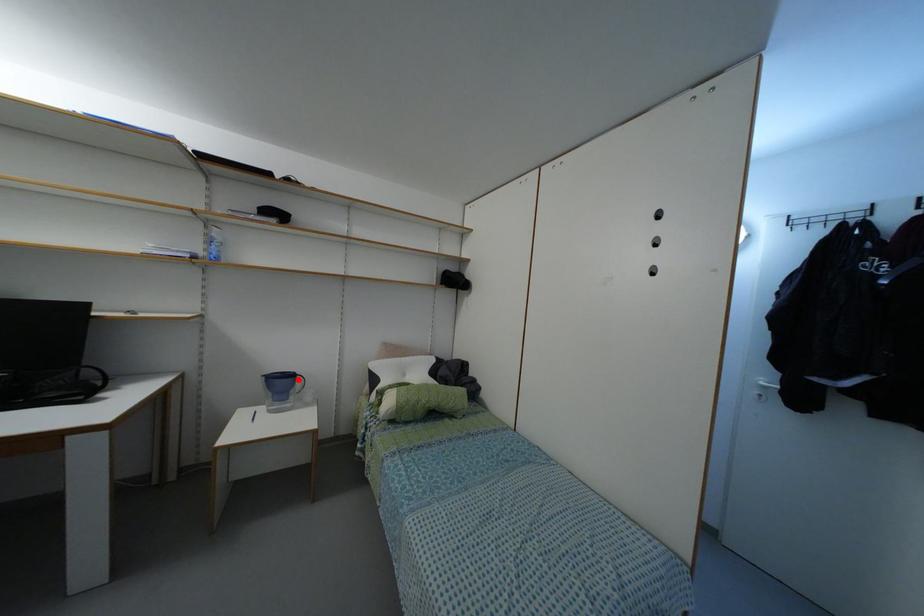
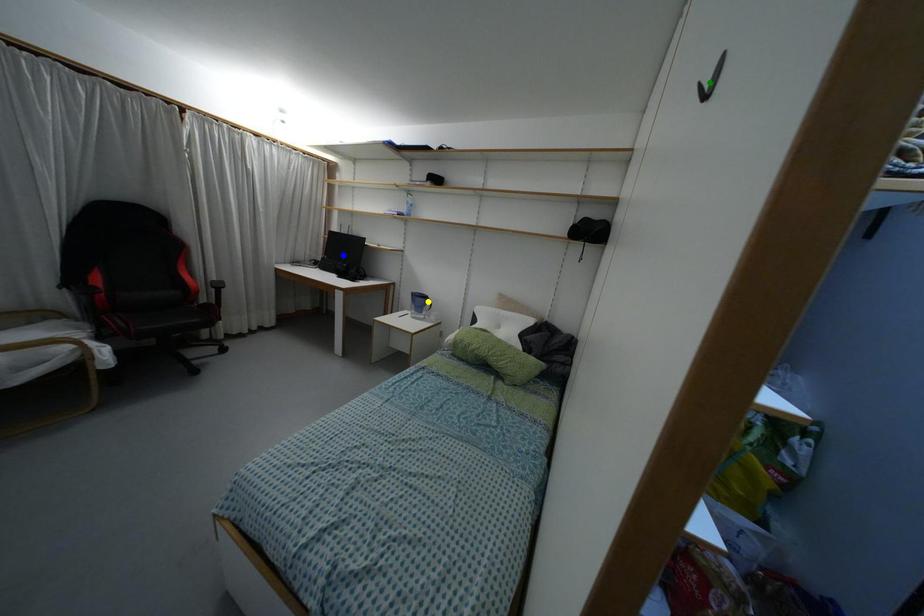
Question: I am providing you with two images of the same scene from different viewpoints. A red point is marked on the first image. You are given multiple points on the second image. Which mark in image 2 goes with the point in image 1?

Choices:
 (A) blue point
 (B) green point
 (C) yellow point

Answer: (C)